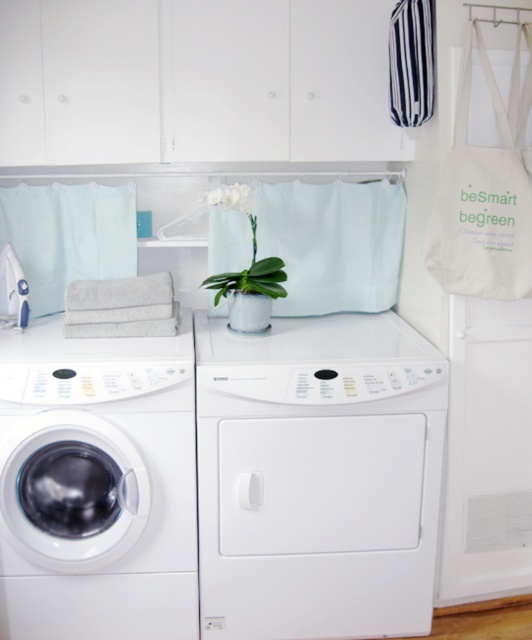
You are standing in the laundry room and want to reach both points. Which point, point (405, 99) or point (253, 225), is closer to you?

Point (405, 99) is closer to the viewer than point (253, 225).

You are arranging flowers in the laundry room and see the blue and white striped fabric at upper right and the green matte orchid at center. Which object is positioned more to the right side of the room?

The blue and white striped fabric at upper right is positioned to the right of the green matte orchid at center, so it is more to the right side of the room.